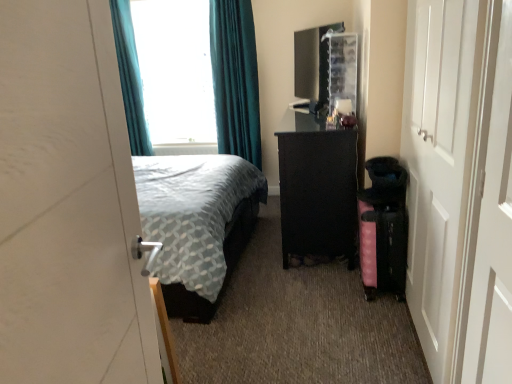
Question: Is pink fabric suitcase at lower right shorter than teal fabric curtain at upper left, positioned as the 1th curtain in left-to-right order?

Choices:
 (A) no
 (B) yes

Answer: (B)

Question: Is pink fabric suitcase at lower right not near teal fabric curtain at upper left, positioned as the 1th curtain in left-to-right order?

Choices:
 (A) no
 (B) yes

Answer: (B)

Question: Is pink fabric suitcase at lower right not within teal fabric curtain at upper left, the 2th curtain from the right?

Choices:
 (A) no
 (B) yes

Answer: (B)

Question: Is teal fabric curtain at upper left, positioned as the 1th curtain in left-to-right order, a part of pink fabric suitcase at lower right?

Choices:
 (A) yes
 (B) no

Answer: (B)

Question: Can you confirm if pink fabric suitcase at lower right is smaller than teal fabric curtain at upper left, the 2th curtain from the right?

Choices:
 (A) no
 (B) yes

Answer: (B)

Question: From their relative heights in the image, would you say teal fabric curtain at upper center, the 1th curtain in the right-to-left sequence, is taller or shorter than black textured dresser at center?

Choices:
 (A) tall
 (B) short

Answer: (A)

Question: From the image's perspective, is teal fabric curtain at upper center, the 2th curtain in the left-to-right sequence, above or below black textured dresser at center?

Choices:
 (A) above
 (B) below

Answer: (A)

Question: Based on their sizes in the image, would you say teal fabric curtain at upper center, the 1th curtain in the right-to-left sequence, is bigger or smaller than black textured dresser at center?

Choices:
 (A) small
 (B) big

Answer: (A)

Question: Is teal fabric curtain at upper center, the 1th curtain in the right-to-left sequence, wider or thinner than black textured dresser at center?

Choices:
 (A) thin
 (B) wide

Answer: (A)

Question: Is teal fabric curtain at upper left, the 2th curtain from the right, inside the boundaries of pink fabric suitcase at lower right, or outside?

Choices:
 (A) outside
 (B) inside

Answer: (A)

Question: In terms of height, does teal fabric curtain at upper left, the 2th curtain from the right, look taller or shorter compared to pink fabric suitcase at lower right?

Choices:
 (A) short
 (B) tall

Answer: (B)

Question: Based on their sizes in the image, would you say teal fabric curtain at upper left, the 2th curtain from the right, is bigger or smaller than pink fabric suitcase at lower right?

Choices:
 (A) small
 (B) big

Answer: (B)

Question: Does point (124, 36) appear closer or farther from the camera than point (371, 236)?

Choices:
 (A) closer
 (B) farther

Answer: (B)

Question: Is point (387, 213) closer or farther from the camera than point (225, 94)?

Choices:
 (A) farther
 (B) closer

Answer: (B)

Question: Is pink fabric suitcase at lower right to the left or to the right of teal fabric curtain at upper center, the 2th curtain in the left-to-right sequence, in the image?

Choices:
 (A) right
 (B) left

Answer: (A)